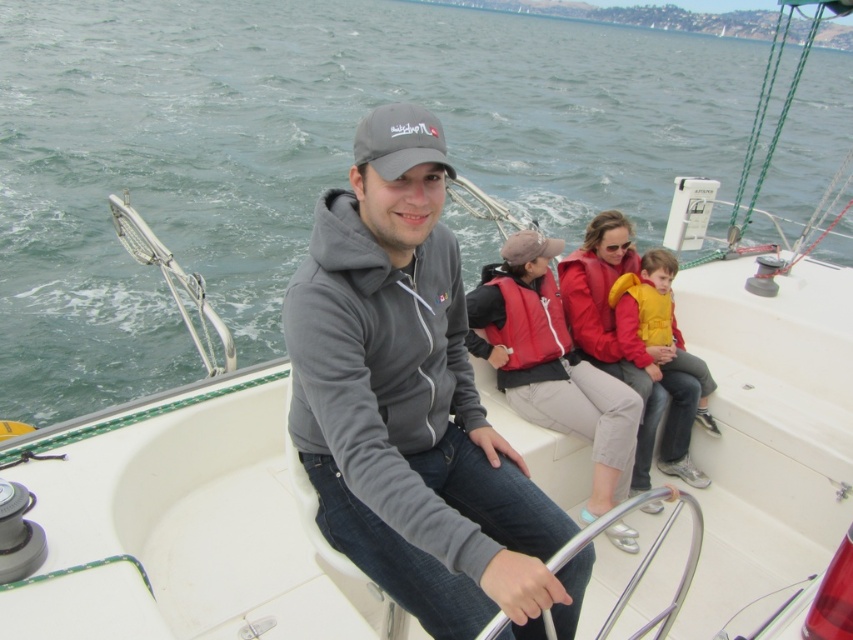
Who is taller, white plastic boat at center or gray hoodie at center?

white plastic boat at center

The height and width of the screenshot is (640, 853). Describe the element at coordinates (184, 524) in the screenshot. I see `white plastic boat at center` at that location.

Does point (297, 573) come behind point (416, 296)?

That is True.

Image resolution: width=853 pixels, height=640 pixels. I want to click on white plastic boat at center, so click(x=184, y=524).

Does white plastic boat at center appear on the right side of matte red life vest at center?

Indeed, white plastic boat at center is positioned on the right side of matte red life vest at center.

Which of these two, white plastic boat at center or matte red life vest at center, stands taller?

Standing taller between the two is white plastic boat at center.

Who is more distant from viewer, (793, 269) or (645, 445)?

Point (793, 269)

Where is `white plastic boat at center`? white plastic boat at center is located at coordinates (184, 524).

Does green water at center appear under white plastic boat at center?

Incorrect, green water at center is not positioned below white plastic boat at center.

Can you confirm if green water at center is positioned above white plastic boat at center?

Correct, green water at center is located above white plastic boat at center.

Image resolution: width=853 pixels, height=640 pixels. I want to click on green water at center, so click(300, 154).

This screenshot has height=640, width=853. I want to click on green water at center, so click(300, 154).